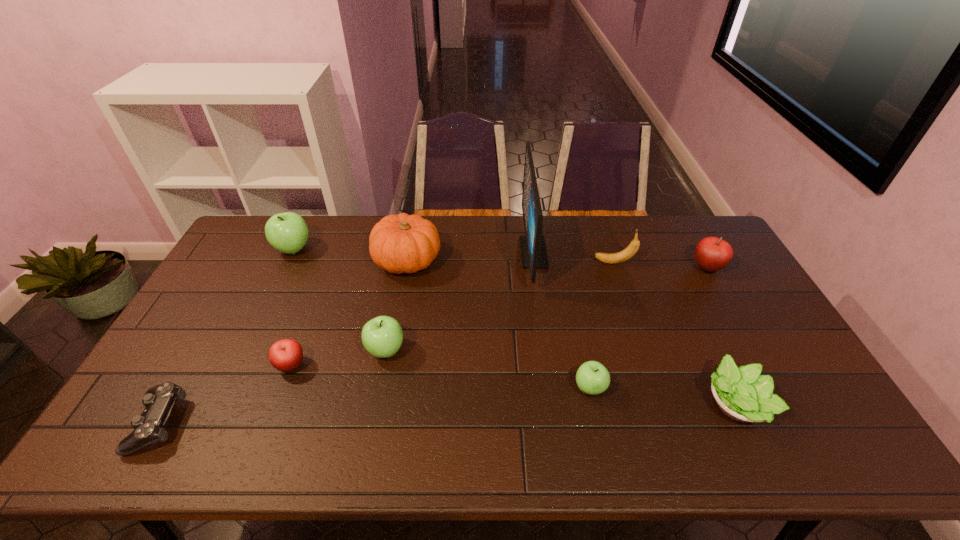
Identify the location of apple that is the fourth closest to the yellow banana. (285, 355).

Identify which apple is the closest to the biggest green apple. Please provide its 2D coordinates. Your answer should be formatted as a tuple, i.e. [(x, y)], where the tuple contains the x and y coordinates of a point satisfying the conditions above.

[(285, 355)]

Locate which green apple is the closest to the lettuce. Please provide its 2D coordinates. Your answer should be formatted as a tuple, i.e. [(x, y)], where the tuple contains the x and y coordinates of a point satisfying the conditions above.

[(592, 378)]

In order to click on green apple that is the third closest to the right red apple in this screenshot , I will do `click(287, 232)`.

The image size is (960, 540). What are the coordinates of `free point that satisfies the following two spatial constraints: 1. at the start of the peel on the banana; 2. on the back side of the green lettuce` in the screenshot? It's located at (661, 404).

Find the location of a particular element. The width and height of the screenshot is (960, 540). vacant space that satisfies the following two spatial constraints: 1. on the front side of the pumpkin; 2. on the right side of the second apple from right to left is located at coordinates (384, 388).

At what (x,y) coordinates should I click in order to perform the action: click on vacant region that satisfies the following two spatial constraints: 1. on the screen side of the tallest object; 2. on the front side of the pumpkin. Please return your answer as a coordinate pair (x, y). Looking at the image, I should click on (535, 261).

Locate an element on the screen. free space that satisfies the following two spatial constraints: 1. on the front side of the second green apple from right to left; 2. on the left side of the biggest green apple is located at coordinates (244, 350).

The width and height of the screenshot is (960, 540). In order to click on free spot that satisfies the following two spatial constraints: 1. on the back side of the farther red apple; 2. at the start of the peel on the yellow banana in this screenshot , I will do `click(705, 262)`.

Find the location of a particular element. The width and height of the screenshot is (960, 540). vacant space that satisfies the following two spatial constraints: 1. at the start of the peel on the banana; 2. on the back side of the green lettuce is located at coordinates (661, 404).